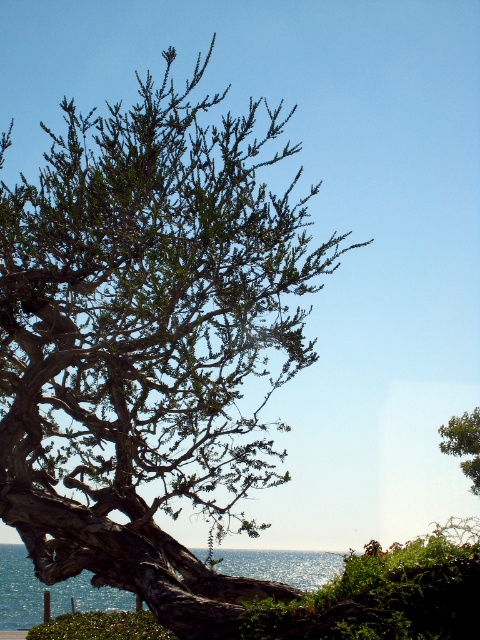
You are a bird flying over the coastal scene. You need to land on the blue reflective water at lower left but must avoid the green leafy tree at upper right. Can you safely land there without hitting the tree?

The blue reflective water at lower left is positioned under the green leafy tree at upper right, so the tree may block the landing path. You should approach carefully to avoid the branches extending over the water.

You are a drone operator trying to capture a photo of the green leafy tree at center. The camera is currently positioned at point 0.5, 0.3. To ensure the tree is centered in the photo, should you move the camera slightly to the north or south?

The green leafy tree at center is located at point (149, 344). Since the camera is at (144, 320), which is slightly to the southwest of the tree, you should move the camera slightly to the north and east to center the tree.

You are standing at the point with coordinates [149,344] in the coastal scene. What object is located exactly at this point?

The green leafy tree at center is located exactly at point [149,344].